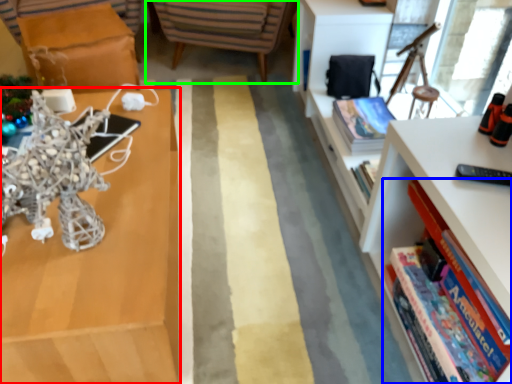
Question: Estimate the real-world distances between objects in this image. Which object is closer to shelf (highlighted by a red box), book (highlighted by a blue box) or chair (highlighted by a green box)?

Choices:
 (A) book
 (B) chair

Answer: (A)